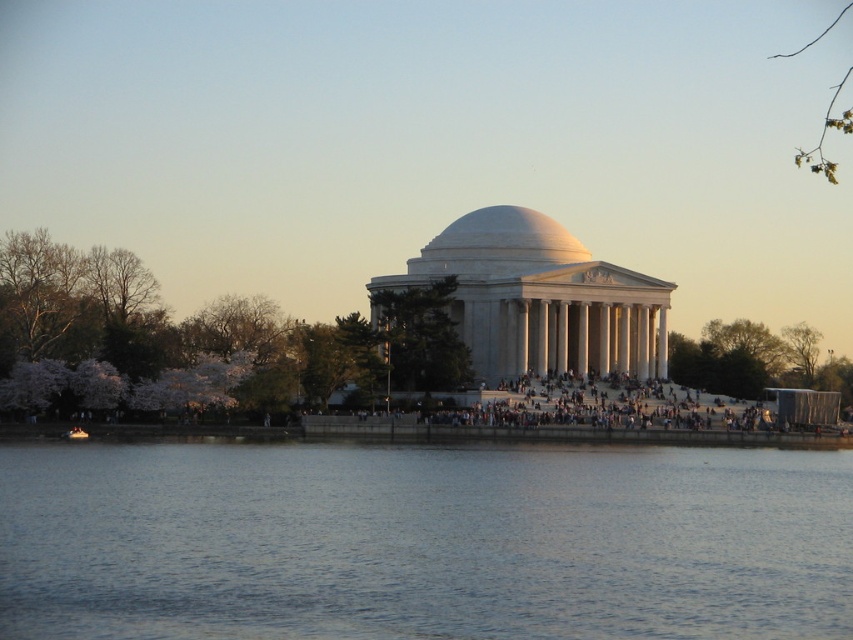
Does green leafy tree at lower right appear under green leafy tree at center?

Yes, green leafy tree at lower right is below green leafy tree at center.

Which is in front, point (817, 387) or point (426, 336)?

Point (426, 336) is in front.

Where is `green leafy tree at lower right`? green leafy tree at lower right is located at coordinates (753, 360).

In the scene shown: Which is more to the left, blue water at center or green leafy tree at center?

green leafy tree at center is more to the left.

Where is `blue water at center`? The height and width of the screenshot is (640, 853). blue water at center is located at coordinates (422, 541).

Where is `blue water at center`? blue water at center is located at coordinates (422, 541).

Is pink blossoms at left behind green leafy tree at lower right?

That is False.

Does point (106, 301) lie in front of point (773, 369)?

Yes, it is.

Locate an element on the screen. pink blossoms at left is located at coordinates (198, 340).